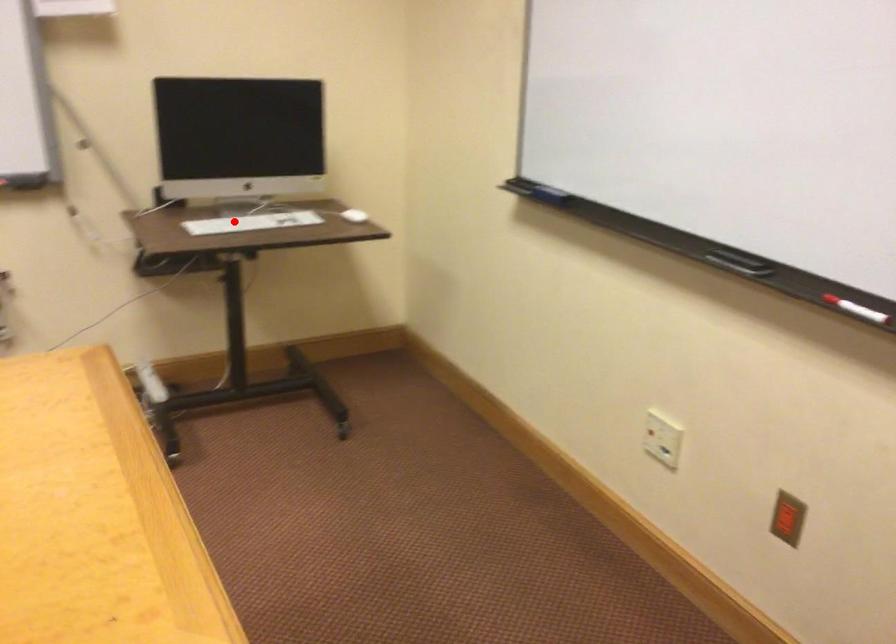
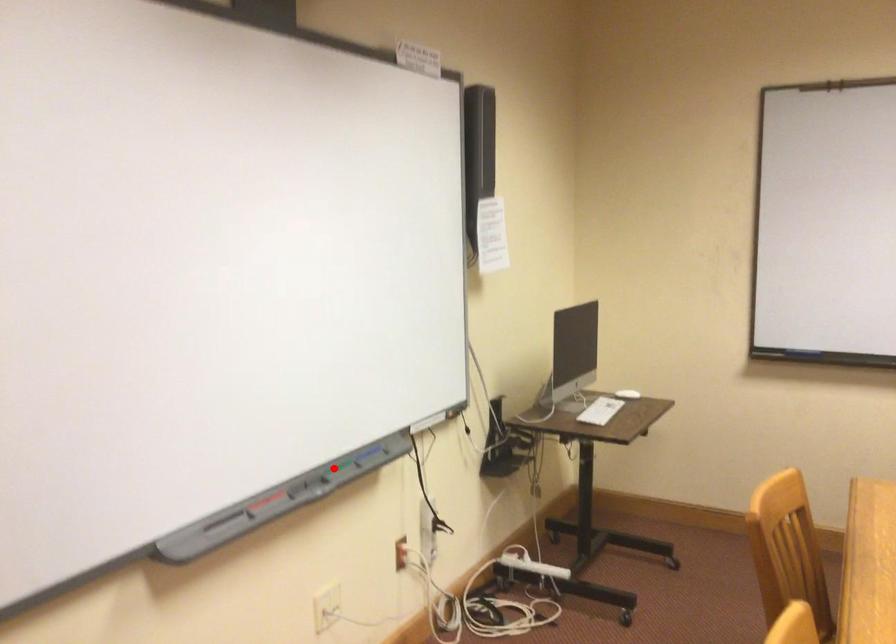
I am providing you with two images of the same scene from different viewpoints. A red point is marked on the first image and another point is marked on the second image. Is the marked point in image1 the same physical position as the marked point in image2?

No